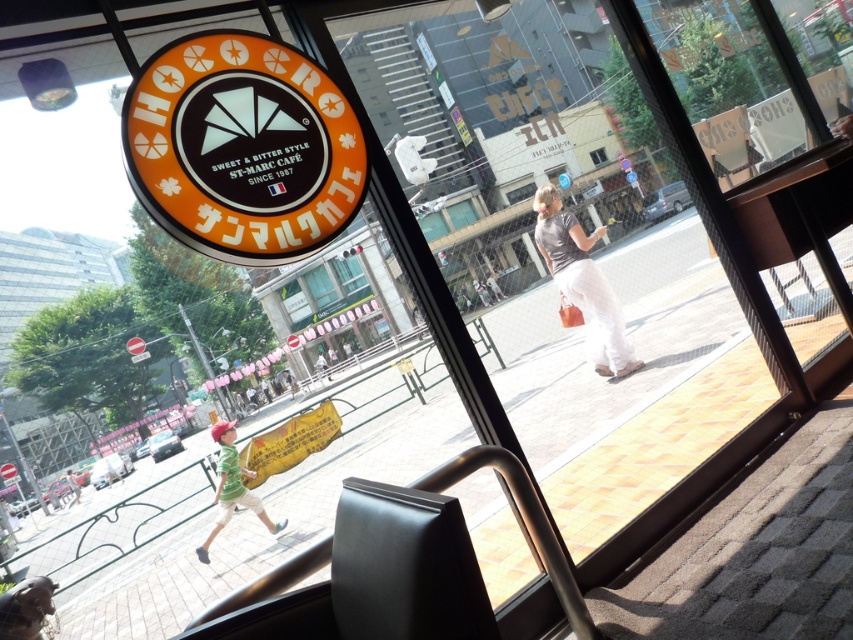
Question: Does green fabric shirt at lower left appear on the left side of green fabric umbrella at center?

Choices:
 (A) yes
 (B) no

Answer: (A)

Question: From the image, what is the correct spatial relationship of orange matte sign at upper left in relation to green fabric umbrella at center?

Choices:
 (A) above
 (B) below

Answer: (A)

Question: Estimate the real-world distances between objects in this image. Which object is farther from the transparent glass window at center?

Choices:
 (A) light brown cotton pants at center
 (B) green striped shirt at lower left

Answer: (A)

Question: Which object is closer to the camera taking this photo?

Choices:
 (A) transparent glass window at center
 (B) light brown cotton pants at center
 (C) green fabric shirt at lower left
 (D) green striped shirt at lower left

Answer: (B)

Question: Is green fabric shirt at lower left further to camera compared to transparent glass window at center?

Choices:
 (A) no
 (B) yes

Answer: (A)

Question: Which of these objects is positioned farthest from the green fabric umbrella at center?

Choices:
 (A) orange matte sign at upper left
 (B) transparent glass window at center

Answer: (A)